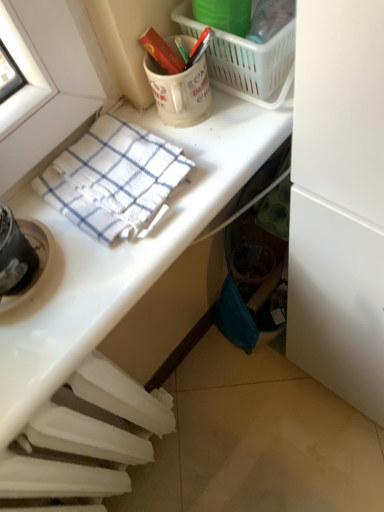
At what (x,y) coordinates should I click in order to perform the action: click on blank space above white checkered towel at upper left (from a real-world perspective). Please return your answer as a coordinate pair (x, y). This screenshot has width=384, height=512. Looking at the image, I should click on (115, 168).